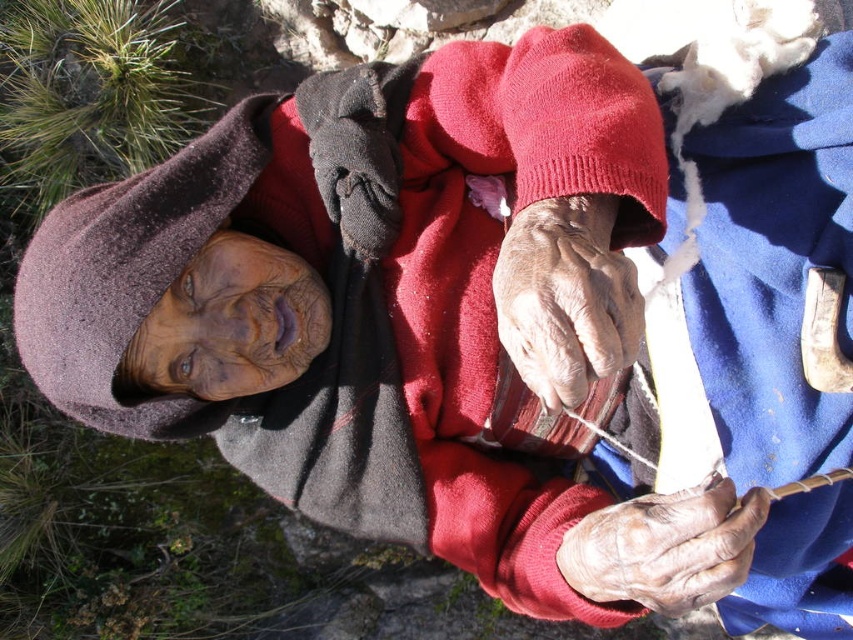
Question: Is dry skin at center positioned before dry skin at lower right?

Choices:
 (A) no
 (B) yes

Answer: (B)

Question: Is dry skin at center further to the viewer compared to dry skin at lower right?

Choices:
 (A) yes
 (B) no

Answer: (B)

Question: Which of the following is the closest to the observer?

Choices:
 (A) dry skin at center
 (B) dry skin at lower right

Answer: (A)

Question: Is dry skin at center further to camera compared to dry skin at lower right?

Choices:
 (A) yes
 (B) no

Answer: (B)